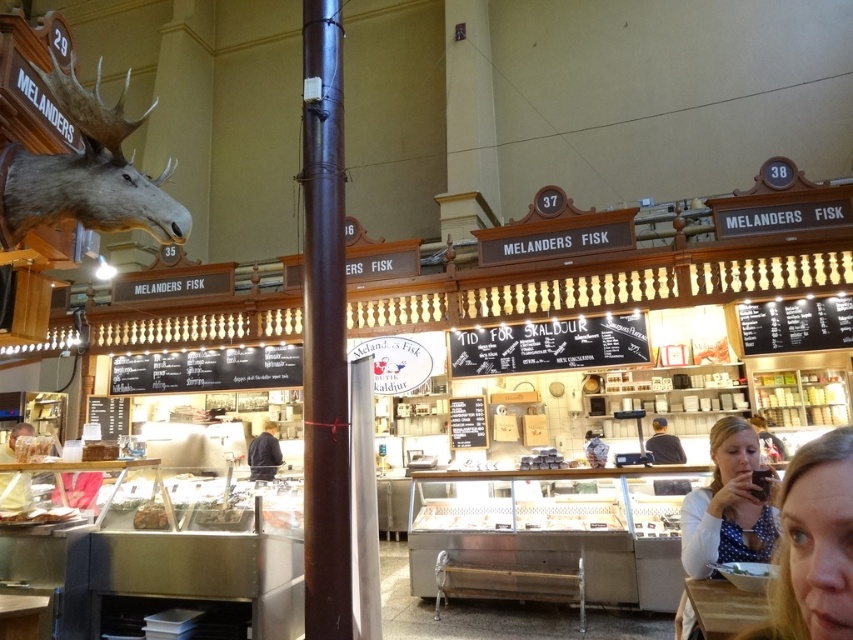
You are a customer at Melanders Fisk fish market and want to reach the dark blue shirt at center to ask a question. However, there is a brown polished wood pole at center in your way. Can you walk around the pole to get to the shirt?

The brown polished wood pole at center is closer to the viewer than dark blue shirt at center, so you can walk around the pole to reach the shirt since the pole is in front of the shirt.

You are a customer at Melanders Fisk and you want to pick up both the polka dot blouse at lower right and the matte brown wooden tray at lower left. Which item should you reach for first if you want to grab the taller one first?

The polka dot blouse at lower right is taller than the matte brown wooden tray at lower left, so you should reach for the polka dot blouse at lower right first.